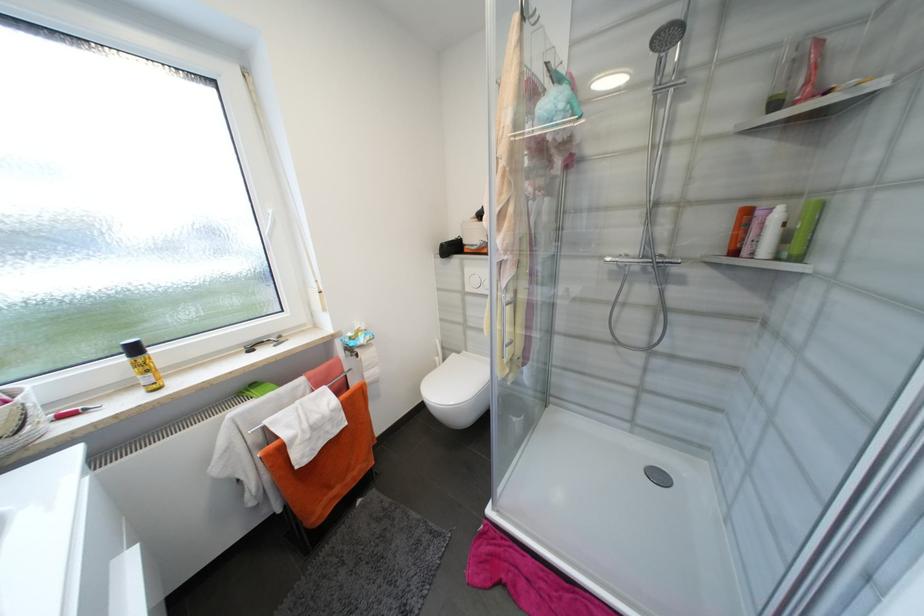
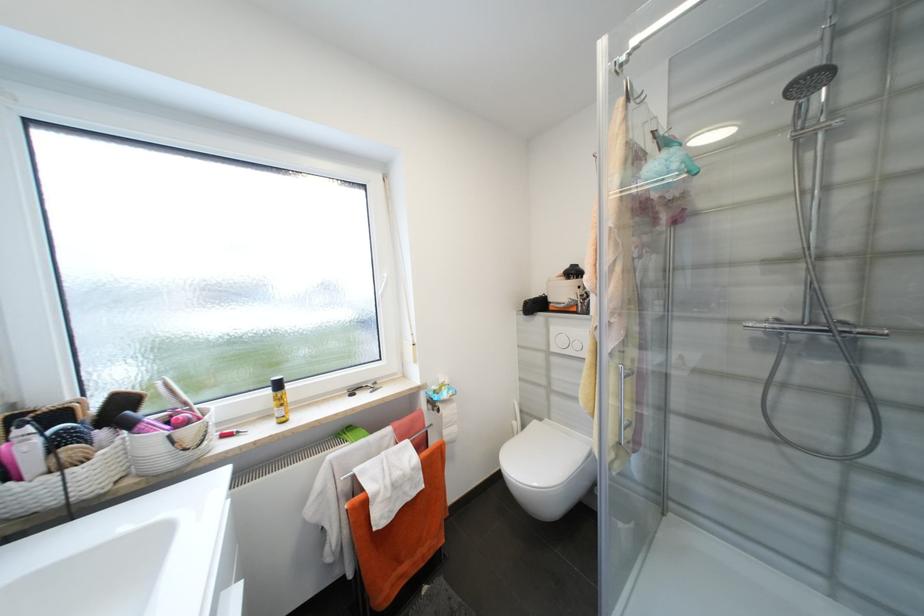
Find the pixel in the second image that matches point 140,351 in the first image.

(284, 386)